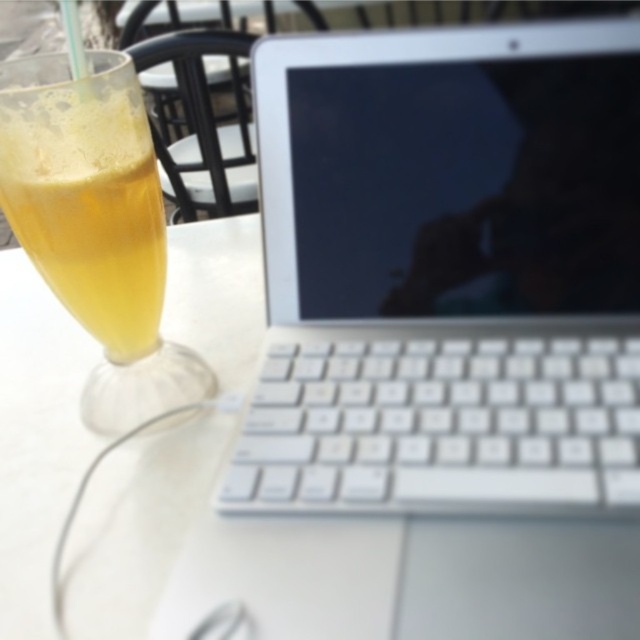
You are a photographer trying to capture the laptop and drink on the table. You notice a point at coordinates point (x=508, y=499) and your camera. How far apart are they?

The point (x=508, y=499) and the camera are 8.34 inches apart.

You are organizing a small event and need to place a decorative centerpiece on the table. Given the current setup with the white plastic laptop at center and the translucent glass at left, which object should you move to make space, and why?

You should move the translucent glass at left because the white plastic laptop at center is larger in size, making it harder to move and less ideal to relocate for the centerpiece.

You are setting up a new workspace and need to place a laptop and a drink on the white plastic table at center. According to the image, where exactly on the table should you position these items to match the original setup?

The white plastic table at center is located at point [35,438]. Position the laptop and drink on the table at these coordinates to match the original setup.